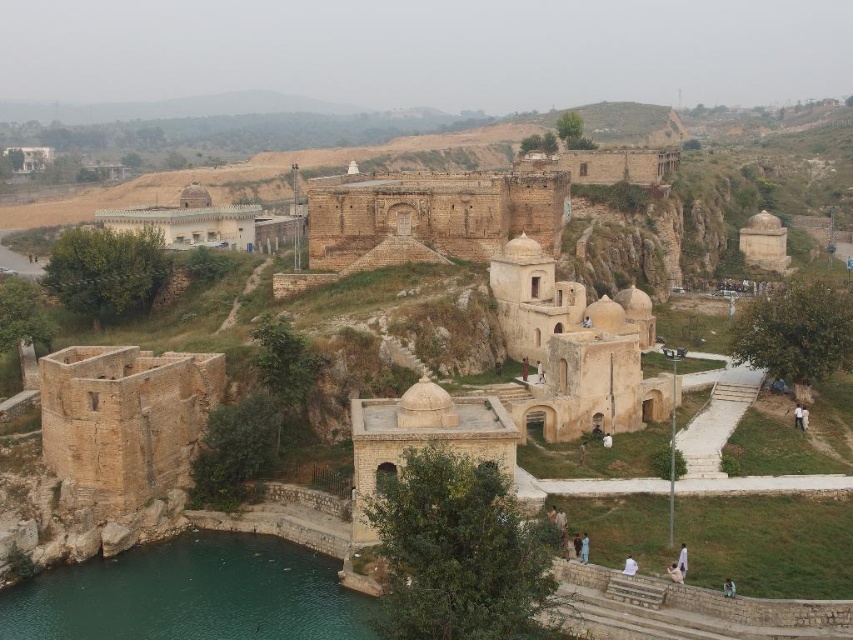
Does green stone water at lower left appear on the left side of light brown stone palace at upper left?

In fact, green stone water at lower left is to the right of light brown stone palace at upper left.

Which is in front, point (368, 624) or point (236, 237)?

Point (368, 624)

The image size is (853, 640). I want to click on green stone water at lower left, so click(190, 595).

Can you confirm if brown stone palace at center is positioned above light brown stone palace at upper left?

Incorrect, brown stone palace at center is not positioned above light brown stone palace at upper left.

Is brown stone palace at center wider than light brown stone palace at upper left?

In fact, brown stone palace at center might be narrower than light brown stone palace at upper left.

Is point (357, 208) less distant than point (212, 243)?

Yes, it is in front of point (212, 243).

At what (x,y) coordinates should I click in order to perform the action: click on brown stone palace at center. Please return your answer as a coordinate pair (x, y). Looking at the image, I should click on (x=433, y=212).

Can you confirm if green stone water at lower left is positioned below brown stone palace at center?

Indeed, green stone water at lower left is positioned under brown stone palace at center.

Which of these two, green stone water at lower left or brown stone palace at center, stands shorter?

green stone water at lower left is shorter.

Which is in front, point (175, 627) or point (466, 216)?

Point (175, 627) is in front.

Image resolution: width=853 pixels, height=640 pixels. Find the location of `green stone water at lower left`. green stone water at lower left is located at coordinates (190, 595).